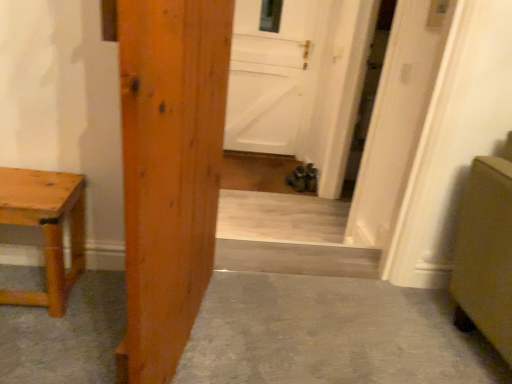
Question: Is natural wood table at left smaller than wooden door at center, acting as the first door starting from the left?

Choices:
 (A) no
 (B) yes

Answer: (B)

Question: Is wooden door at center, which ranks as the first door in front-to-back order, a part of natural wood table at left?

Choices:
 (A) no
 (B) yes

Answer: (A)

Question: From the image's perspective, is natural wood table at left under wooden door at center, marked as the third door in a right-to-left arrangement?

Choices:
 (A) yes
 (B) no

Answer: (A)

Question: Is natural wood table at left oriented towards wooden door at center, acting as the first door starting from the left?

Choices:
 (A) no
 (B) yes

Answer: (A)

Question: Is natural wood table at left facing away from wooden door at center, marked as the third door in a right-to-left arrangement?

Choices:
 (A) no
 (B) yes

Answer: (A)

Question: Considering the relative positions of natural wood table at left and wooden door at center, which appears as the 3th door when viewed from the back, in the image provided, is natural wood table at left to the right of wooden door at center, which appears as the 3th door when viewed from the back, from the viewer's perspective?

Choices:
 (A) yes
 (B) no

Answer: (B)

Question: Does wooden door at center, which appears as the 3th door when viewed from the back, have a lesser height compared to white matte door at center, which is the 2th door in right-to-left order?

Choices:
 (A) no
 (B) yes

Answer: (B)

Question: From a real-world perspective, is wooden door at center, which ranks as the first door in front-to-back order, beneath white matte door at center, marked as the first door in a back-to-front arrangement?

Choices:
 (A) no
 (B) yes

Answer: (A)

Question: Is wooden door at center, which ranks as the first door in front-to-back order, aimed at white matte door at center, marked as the first door in a back-to-front arrangement?

Choices:
 (A) yes
 (B) no

Answer: (B)

Question: Considering the relative sizes of wooden door at center, acting as the first door starting from the left, and white matte door at center, which is the 2th door in right-to-left order, in the image provided, is wooden door at center, acting as the first door starting from the left, taller than white matte door at center, which is the 2th door in right-to-left order,?

Choices:
 (A) no
 (B) yes

Answer: (A)

Question: From the image's perspective, is wooden door at center, marked as the third door in a right-to-left arrangement, under white matte door at center, which is the 2th door from left to right?

Choices:
 (A) yes
 (B) no

Answer: (A)

Question: Does wooden door at center, marked as the third door in a right-to-left arrangement, contain white matte door at center, placed as the third door when sorted from front to back?

Choices:
 (A) yes
 (B) no

Answer: (B)

Question: Does wooden door at center, acting as the first door starting from the left, lie behind natural wood table at left?

Choices:
 (A) no
 (B) yes

Answer: (A)